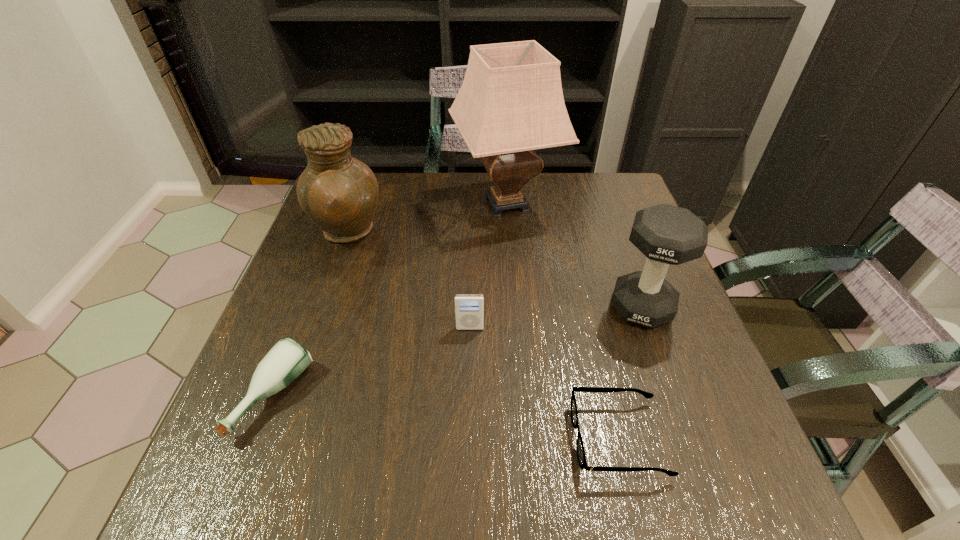
The image size is (960, 540). Find the location of `free point between the iPod and the fourth shortest object`. free point between the iPod and the fourth shortest object is located at coordinates (556, 318).

Locate an element on the screen. The height and width of the screenshot is (540, 960). empty space between the spectacles and the iPod is located at coordinates (544, 383).

This screenshot has height=540, width=960. Find the location of `vacant area that lies between the dumbbell and the shortest object`. vacant area that lies between the dumbbell and the shortest object is located at coordinates tap(630, 373).

Identify the location of vacant area between the fifth tallest object and the dumbbell. (458, 352).

Find the location of a particular element. This screenshot has width=960, height=540. unoccupied area between the shortest object and the tallest object is located at coordinates (563, 321).

The height and width of the screenshot is (540, 960). I want to click on unoccupied position between the iPod and the pitcher, so click(x=408, y=281).

Where is `vacant space that is in between the tallest object and the bottle`? This screenshot has height=540, width=960. vacant space that is in between the tallest object and the bottle is located at coordinates (391, 300).

You are a GUI agent. You are given a task and a screenshot of the screen. Output one action in this format:
    pyautogui.click(x=<x>, y=<y>)
    Task: Click on the free spot between the pitcher and the tallest object
    The image size is (960, 540).
    Given the screenshot: What is the action you would take?
    pyautogui.click(x=426, y=219)

At what (x,y) coordinates should I click in order to perform the action: click on vacant space that's between the pitcher and the bottle. Please return your answer as a coordinate pair (x, y). The height and width of the screenshot is (540, 960). Looking at the image, I should click on (310, 315).

Find the location of `the second closest object to the fifth shortest object`. the second closest object to the fifth shortest object is located at coordinates (287, 359).